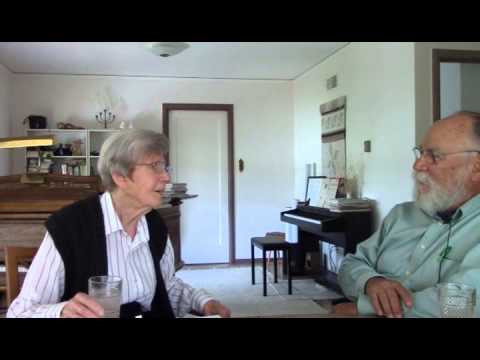
Locate an element on the screen. This screenshot has width=480, height=360. candelabra is located at coordinates (104, 121).